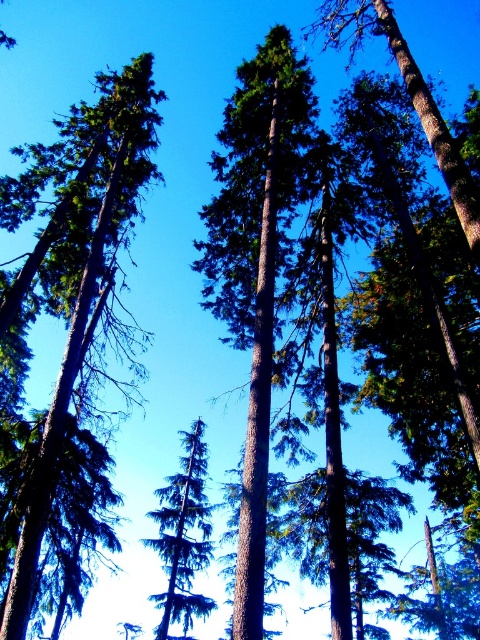
Question: Based on their relative distances, which object is farther from the green textured tree at center?

Choices:
 (A) green matte tree at center
 (B) green rough bark tree at center

Answer: (A)

Question: Is green rough bark tree at center in front of green matte tree at center?

Choices:
 (A) no
 (B) yes

Answer: (B)

Question: Which point is closer to the camera?

Choices:
 (A) green matte tree at center
 (B) green textured tree at center

Answer: (B)

Question: Does green textured tree at center appear on the left side of green matte tree at center?

Choices:
 (A) yes
 (B) no

Answer: (B)

Question: Among these objects, which one is nearest to the camera?

Choices:
 (A) green matte tree at center
 (B) green rough bark tree at center

Answer: (B)

Question: Is green textured tree at center bigger than green matte tree at center?

Choices:
 (A) no
 (B) yes

Answer: (A)